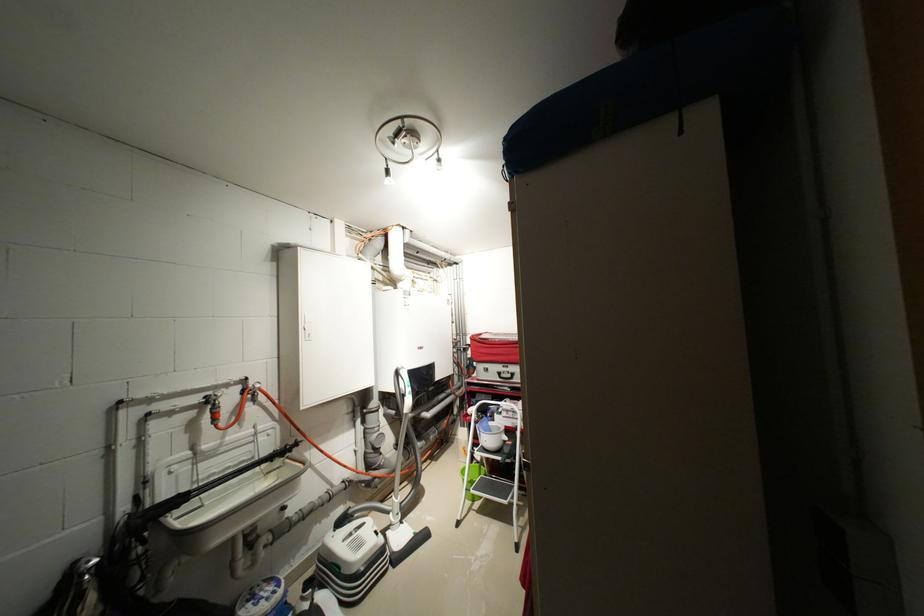
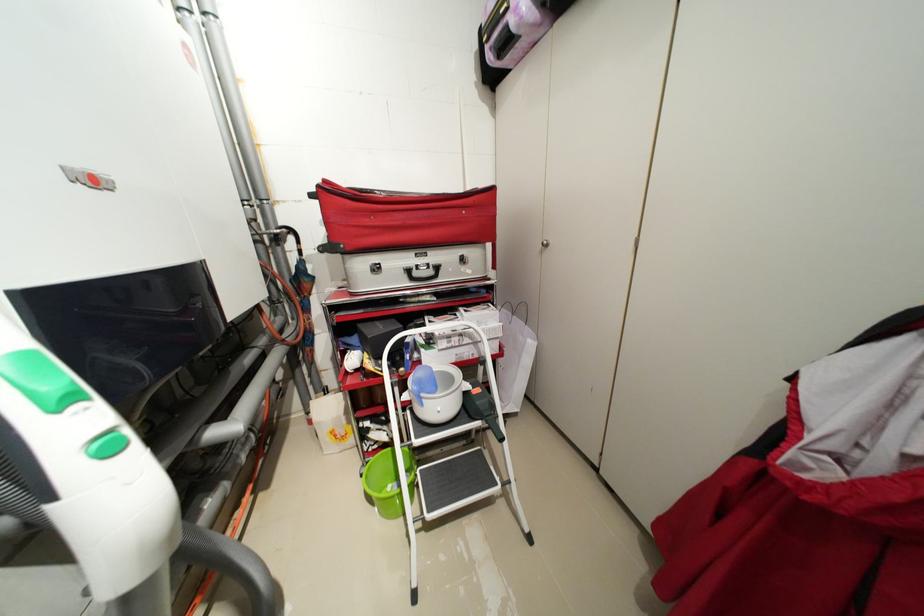
Find the pixel in the second image that matches pixel 509 376 in the first image.

(422, 275)